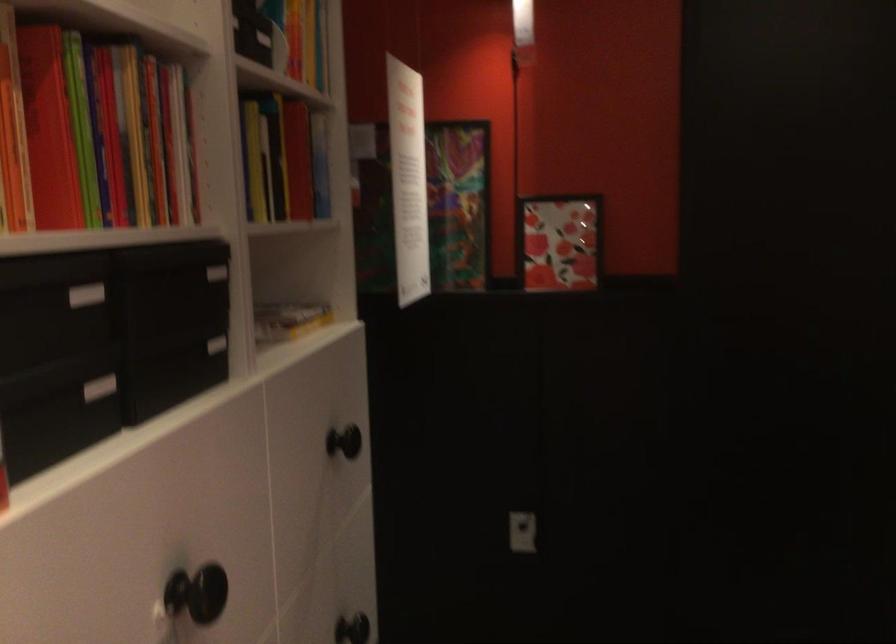
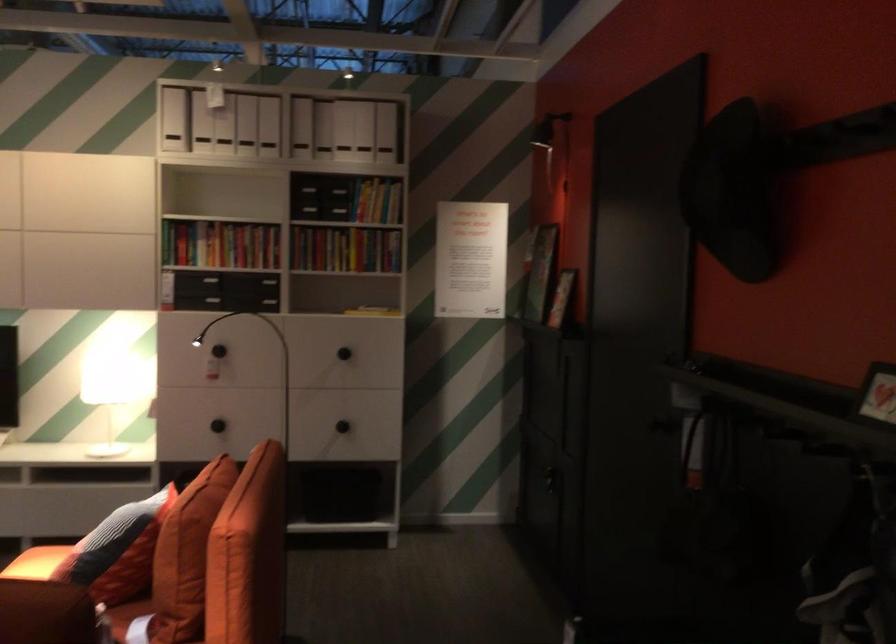
Question: I am providing you with two images of the same scene from different viewpoints. Which of the following objects are not visible in image2?

Choices:
 (A) colorful book
 (B) white magazine file
 (C) sofa sitting surface
 (D) none of these

Answer: (D)